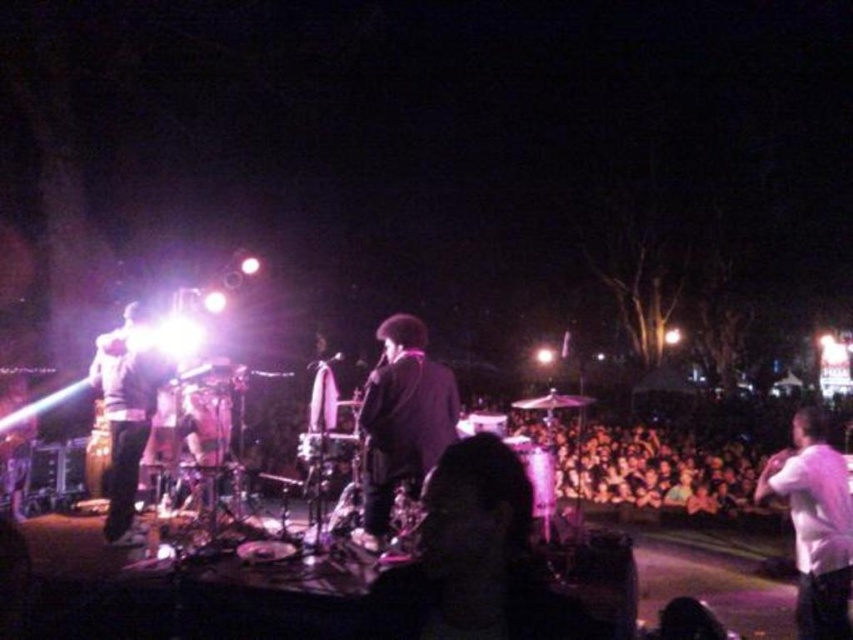
Who is positioned more to the left, dark hair at center or white matte shirt at right?

Positioned to the left is dark hair at center.

Is point (519, 506) behind point (808, 586)?

No.

Is point (492, 541) closer to camera compared to point (804, 438)?

Yes, it is in front of point (804, 438).

At what (x,y) coordinates should I click in order to perform the action: click on dark hair at center. Please return your answer as a coordinate pair (x, y). The image size is (853, 640). Looking at the image, I should click on [474, 560].

Who is positioned more to the right, dark hair at center or shiny black saxophone at center?

dark hair at center is more to the right.

Is point (473, 621) closer to viewer compared to point (381, 513)?

Yes, point (473, 621) is in front of point (381, 513).

Does point (515, 525) come farther from viewer compared to point (418, 412)?

No, it is in front of (418, 412).

This screenshot has height=640, width=853. I want to click on dark hair at center, so click(x=474, y=560).

Who is more forward, (424, 461) or (132, 538)?

Point (424, 461) is more forward.

How distant is shiny black saxophone at center from shiny silver guitar at left?

They are 2.13 meters apart.

Which is behind, point (370, 442) or point (122, 422)?

Positioned behind is point (122, 422).

Identify the location of shiny black saxophone at center. The image size is (853, 640). point(401,422).